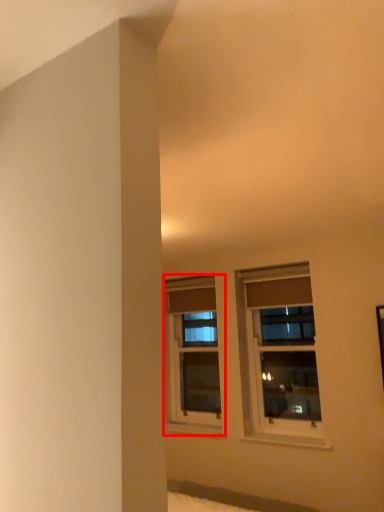
Question: From the image's perspective, what is the correct spatial relationship of window (annotated by the red box) in relation to window?

Choices:
 (A) below
 (B) above

Answer: (A)